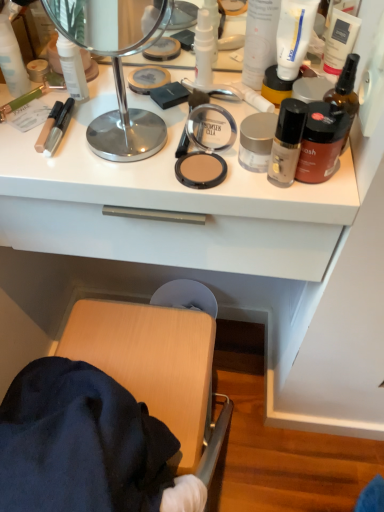
Identify the location of free space to the back side of polished silver mirror at upper center. The width and height of the screenshot is (384, 512). (129, 89).